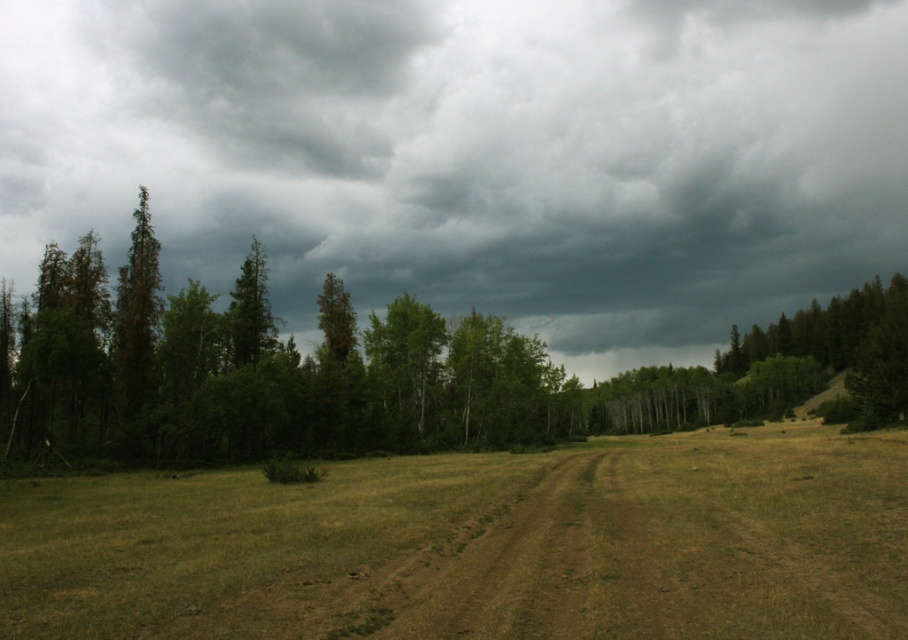
Question: Among these objects, which one is nearest to the camera?

Choices:
 (A) dark gray cloud at upper center
 (B) brown dirt track at center

Answer: (B)

Question: Is dark gray cloud at upper center positioned at the back of brown dirt track at center?

Choices:
 (A) no
 (B) yes

Answer: (B)

Question: Which point is closer to the camera?

Choices:
 (A) (630, 365)
 (B) (436, 634)

Answer: (B)

Question: Can you confirm if dark gray cloud at upper center is positioned below brown dirt track at center?

Choices:
 (A) no
 (B) yes

Answer: (A)

Question: From the image, what is the correct spatial relationship of dark gray cloud at upper center in relation to brown dirt track at center?

Choices:
 (A) right
 (B) left

Answer: (A)